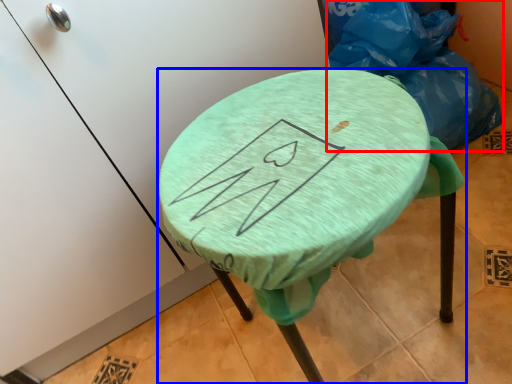
Question: Which of the following is the closest to the observer, garbage (highlighted by a red box) or furniture (highlighted by a blue box)?

Choices:
 (A) garbage
 (B) furniture

Answer: (B)